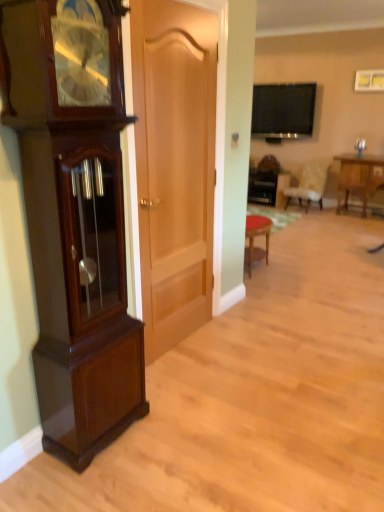
Question: Is mahogany wood grandfather clock at left to the right of wooden table at center, which appears as the second table when viewed from the front, from the viewer's perspective?

Choices:
 (A) no
 (B) yes

Answer: (A)

Question: From a real-world perspective, does mahogany wood grandfather clock at left stand above wooden table at center, the 2th table positioned from the right?

Choices:
 (A) yes
 (B) no

Answer: (A)

Question: Is mahogany wood grandfather clock at left thinner than wooden table at center, which is counted as the first table, starting from the back?

Choices:
 (A) no
 (B) yes

Answer: (B)

Question: From the image's perspective, is mahogany wood grandfather clock at left located beneath wooden table at center, which is counted as the first table, starting from the back?

Choices:
 (A) no
 (B) yes

Answer: (B)

Question: Would you say mahogany wood grandfather clock at left contains wooden table at center, which is counted as the first table, starting from the back?

Choices:
 (A) yes
 (B) no

Answer: (B)

Question: Is mahogany wood grandfather clock at left closer to the viewer compared to wooden table at center, which appears as the second table when viewed from the front?

Choices:
 (A) yes
 (B) no

Answer: (A)

Question: Is wooden table at right, which is the second table in left-to-right order, bigger than flat-screen tv at upper center?

Choices:
 (A) yes
 (B) no

Answer: (A)

Question: Is wooden table at right, the first table viewed from the front, positioned with its back to flat-screen tv at upper center?

Choices:
 (A) yes
 (B) no

Answer: (B)

Question: Does wooden table at right, the first table viewed from the front, have a lesser height compared to flat-screen tv at upper center?

Choices:
 (A) yes
 (B) no

Answer: (A)

Question: Is wooden table at right, which is the second table in left-to-right order, positioned in front of flat-screen tv at upper center?

Choices:
 (A) yes
 (B) no

Answer: (A)

Question: Does wooden table at right, the first table viewed from the front, have a lesser width compared to flat-screen tv at upper center?

Choices:
 (A) no
 (B) yes

Answer: (A)

Question: From a real-world perspective, is wooden table at right, marked as the second table in a back-to-front arrangement, physically below flat-screen tv at upper center?

Choices:
 (A) no
 (B) yes

Answer: (B)

Question: Does wooden table at center, the 2th table positioned from the right, have a lesser height compared to light beige fabric chair at center?

Choices:
 (A) no
 (B) yes

Answer: (B)